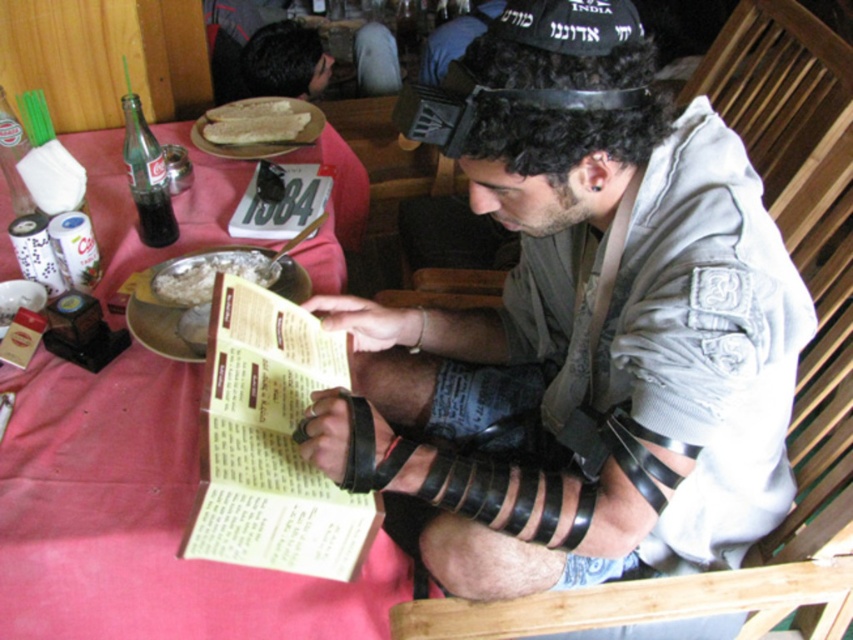
Question: In this image, where is yellow paper at center located relative to black fabric baseball hat at upper center?

Choices:
 (A) above
 (B) below

Answer: (B)

Question: Which object appears farthest from the camera in this image?

Choices:
 (A) white flatbread at upper center
 (B) yellow paper at center
 (C) black fabric baseball hat at upper center

Answer: (A)

Question: Is pink fabric table at center below white flatbread at upper center?

Choices:
 (A) no
 (B) yes

Answer: (B)

Question: Among these points, which one is farthest from the camera?

Choices:
 (A) (343, 506)
 (B) (207, 260)

Answer: (B)

Question: Considering the relative positions of yellow paper at center and black fabric baseball hat at upper center in the image provided, where is yellow paper at center located with respect to black fabric baseball hat at upper center?

Choices:
 (A) right
 (B) left

Answer: (B)

Question: Which object is farther from the camera taking this photo?

Choices:
 (A) yellow paper at center
 (B) white flatbread at upper center

Answer: (B)